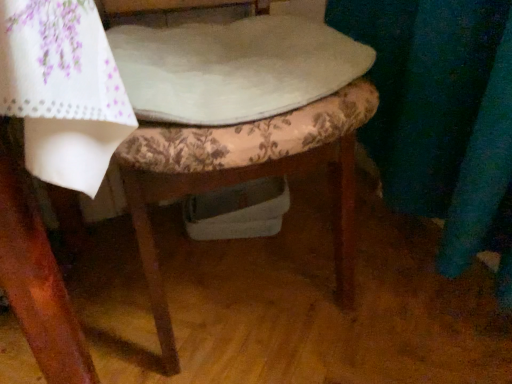
The height and width of the screenshot is (384, 512). What do you see at coordinates (233, 68) in the screenshot?
I see `white fabric at center` at bounding box center [233, 68].

Identify the location of white fabric at center. The height and width of the screenshot is (384, 512). (233, 68).

Measure the distance between white fabric at center and camera.

19.96 inches.

Where is `floral fabric cushion at center`? Image resolution: width=512 pixels, height=384 pixels. floral fabric cushion at center is located at coordinates (245, 176).

What do you see at coordinates (245, 176) in the screenshot?
I see `floral fabric cushion at center` at bounding box center [245, 176].

What are the coordinates of `white fabric at center` in the screenshot? It's located at (233, 68).

Does floral fabric cushion at center appear on the left side of white fabric at center?

Yes.

Based on the photo, does floral fabric cushion at center lie behind white fabric at center?

No, floral fabric cushion at center is in front of white fabric at center.

Which is nearer, (45, 368) or (292, 80)?

Point (45, 368) is positioned closer to the camera compared to point (292, 80).

From the image's perspective, between floral fabric cushion at center and white fabric at center, who is located below?

floral fabric cushion at center is shown below in the image.

From a real-world perspective, is floral fabric cushion at center below white fabric at center?

Yes.

Considering the sizes of objects floral fabric cushion at center and white fabric at center in the image provided, who is thinner, floral fabric cushion at center or white fabric at center?

white fabric at center is thinner.

Can you confirm if floral fabric cushion at center is taller than white fabric at center?

Correct, floral fabric cushion at center is much taller as white fabric at center.

Considering the sizes of objects floral fabric cushion at center and white fabric at center in the image provided, who is bigger, floral fabric cushion at center or white fabric at center?

floral fabric cushion at center.

Is floral fabric cushion at center spatially inside white fabric at center, or outside of it?

floral fabric cushion at center lies outside white fabric at center.

Is there a large distance between floral fabric cushion at center and white fabric at center?

Actually, floral fabric cushion at center and white fabric at center are a little close together.

Is floral fabric cushion at center turned away from white fabric at center?

Absolutely, floral fabric cushion at center is directed away from white fabric at center.

Can you tell me how much floral fabric cushion at center and white fabric at center differ in facing direction?

They differ by 2.31 degrees in their facing directions.

Image resolution: width=512 pixels, height=384 pixels. I want to click on chair lying in front of the white fabric at center, so click(245, 176).

Based on their positions, is white fabric at center located to the left or right of floral fabric cushion at center?

white fabric at center is positioned on floral fabric cushion at center's right side.

Is white fabric at center further to the viewer compared to floral fabric cushion at center?

Yes.

Which is farther, (303, 96) or (154, 269)?

The point (154, 269) is farther from the camera.

From the image's perspective, which one is positioned lower, white fabric at center or floral fabric cushion at center?

From the image's view, floral fabric cushion at center is below.

From a real-world perspective, between white fabric at center and floral fabric cushion at center, who is vertically lower?

floral fabric cushion at center is physically lower.

In terms of width, does white fabric at center look wider or thinner when compared to floral fabric cushion at center?

In the image, white fabric at center appears to be more narrow than floral fabric cushion at center.

Considering the sizes of objects white fabric at center and floral fabric cushion at center in the image provided, who is taller, white fabric at center or floral fabric cushion at center?

Standing taller between the two is floral fabric cushion at center.

Looking at the image, does white fabric at center seem bigger or smaller compared to floral fabric cushion at center?

Clearly, white fabric at center is smaller in size than floral fabric cushion at center.

Choose the correct answer: Is white fabric at center inside floral fabric cushion at center or outside it?

white fabric at center is contained in floral fabric cushion at center.

Is white fabric at center not near floral fabric cushion at center?

No.

Is white fabric at center oriented away from floral fabric cushion at center?

Yes, white fabric at center's orientation is away from floral fabric cushion at center.

Where is `sheet behind the floral fabric cushion at center`? The image size is (512, 384). sheet behind the floral fabric cushion at center is located at coordinates (233, 68).

At what (x,y) coordinates should I click in order to perform the action: click on chair that is on the left side of white fabric at center. Please return your answer as a coordinate pair (x, y). Looking at the image, I should click on (245, 176).

Where is `sheet behind the floral fabric cushion at center`? The width and height of the screenshot is (512, 384). sheet behind the floral fabric cushion at center is located at coordinates (233, 68).